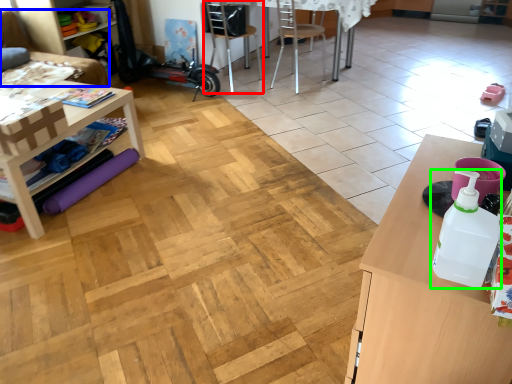
Question: Which object is positioned closest to chair (highlighted by a red box)? Select from couch (highlighted by a blue box) and bottle (highlighted by a green box).

Choices:
 (A) couch
 (B) bottle

Answer: (A)